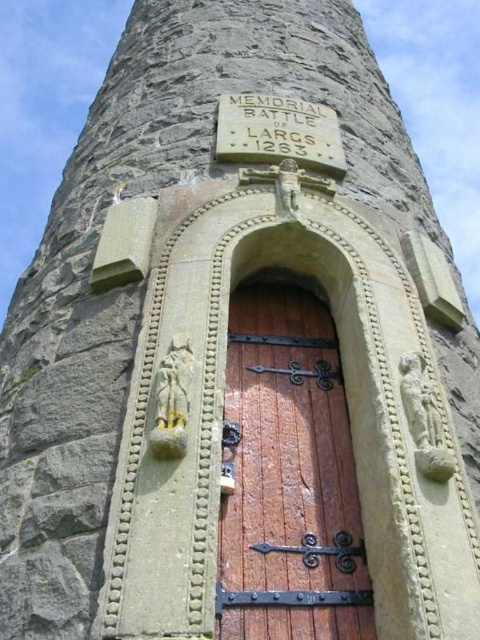
Question: Does wooden door at center have a greater width compared to stone plaque at center?

Choices:
 (A) no
 (B) yes

Answer: (A)

Question: Can you confirm if wooden door at center is positioned to the left of stone plaque at center?

Choices:
 (A) yes
 (B) no

Answer: (B)

Question: Is the position of wooden door at center less distant than that of stone plaque at center?

Choices:
 (A) yes
 (B) no

Answer: (A)

Question: Which of the following is the closest to the observer?

Choices:
 (A) (312, 548)
 (B) (317, 161)

Answer: (A)

Question: Which point appears farthest from the camera in this image?

Choices:
 (A) (286, 125)
 (B) (226, 630)

Answer: (A)

Question: Among these points, which one is nearest to the camera?

Choices:
 (A) (243, 298)
 (B) (335, 154)

Answer: (A)